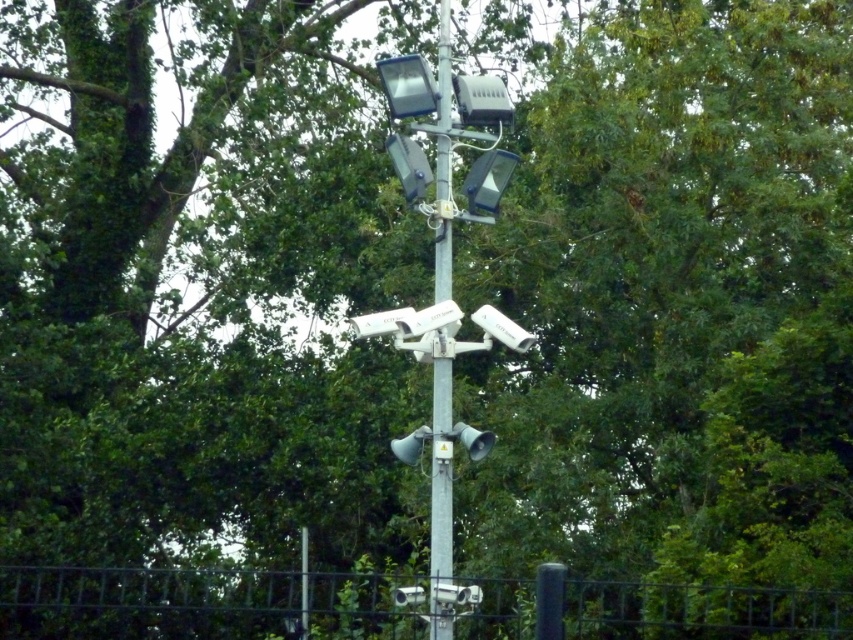
Question: Is metallic wire mesh at lower center positioned before metallic gray pole at center?

Choices:
 (A) yes
 (B) no

Answer: (A)

Question: Does metallic wire mesh at lower center appear over metallic gray pole at center?

Choices:
 (A) yes
 (B) no

Answer: (B)

Question: Can you confirm if metallic wire mesh at lower center is positioned to the left of metallic gray pole at center?

Choices:
 (A) no
 (B) yes

Answer: (B)

Question: Which point is farther to the camera?

Choices:
 (A) (682, 634)
 (B) (431, 560)

Answer: (A)